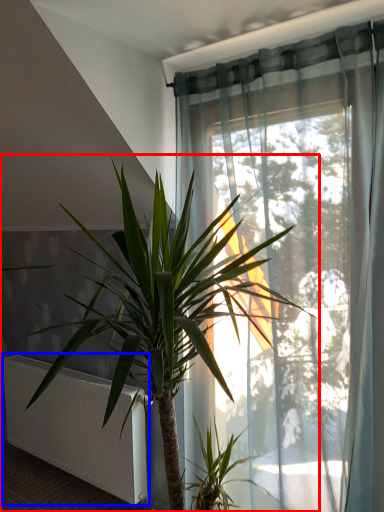
Question: Among these objects, which one is nearest to the camera, houseplant (highlighted by a red box) or radiator (highlighted by a blue box)?

Choices:
 (A) houseplant
 (B) radiator

Answer: (A)